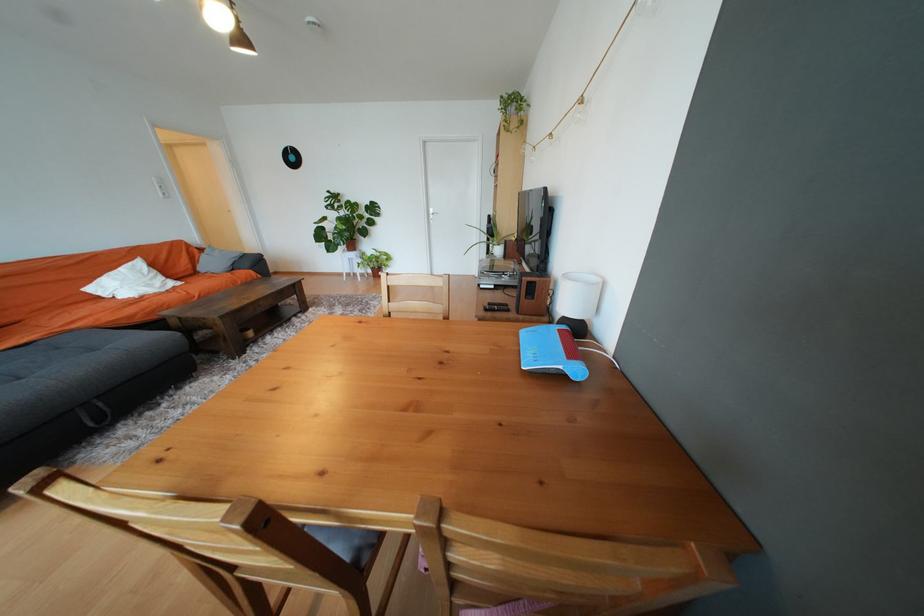
Where would you lift the wooden speaker? Please return your answer as a coordinate pair (x, y).

(532, 294)